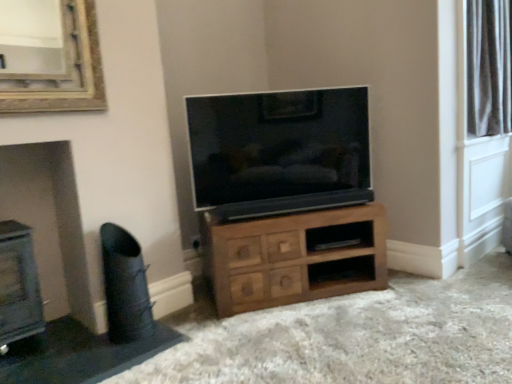
Image resolution: width=512 pixels, height=384 pixels. Identify the location of empty space that is in between blue painted wood fireplace at lower left and black leather swivel chair at lower left. (70, 347).